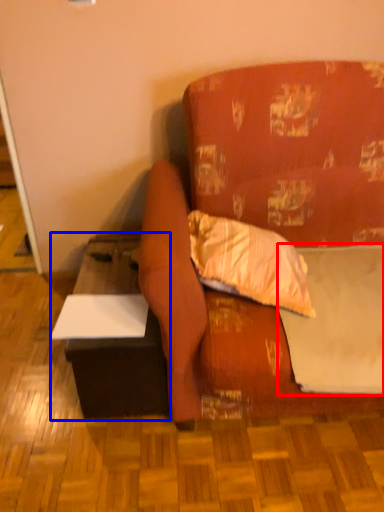
Question: Among these objects, which one is nearest to the camera, sheet (highlighted by a red box) or table (highlighted by a blue box)?

Choices:
 (A) sheet
 (B) table

Answer: (A)